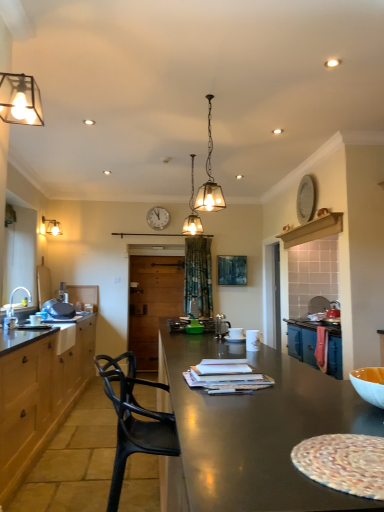
Question: Is satin silver coffee pot at center shorter than white wooden clock at upper center?

Choices:
 (A) yes
 (B) no

Answer: (A)

Question: Does satin silver coffee pot at center have a greater height compared to white wooden clock at upper center?

Choices:
 (A) no
 (B) yes

Answer: (A)

Question: Does satin silver coffee pot at center appear on the left side of white wooden clock at upper center?

Choices:
 (A) no
 (B) yes

Answer: (A)

Question: From a real-world perspective, does satin silver coffee pot at center sit lower than white wooden clock at upper center?

Choices:
 (A) no
 (B) yes

Answer: (B)

Question: Is the surface of satin silver coffee pot at center in direct contact with white wooden clock at upper center?

Choices:
 (A) yes
 (B) no

Answer: (B)

Question: Would you say translucent glass pendant light at center, which ranks as the 2th lamp in right-to-left order, is inside or outside wooden cabinets at left?

Choices:
 (A) inside
 (B) outside

Answer: (B)

Question: From the image's perspective, is translucent glass pendant light at center, positioned as the 3th lamp in left-to-right order, located above or below wooden cabinets at left?

Choices:
 (A) below
 (B) above

Answer: (B)

Question: Is translucent glass pendant light at center, positioned as the 3th lamp in left-to-right order, bigger or smaller than wooden cabinets at left?

Choices:
 (A) small
 (B) big

Answer: (A)

Question: From a real-world perspective, relative to wooden cabinets at left, is translucent glass pendant light at center, positioned as the 3th lamp in left-to-right order, vertically above or below?

Choices:
 (A) below
 (B) above

Answer: (B)

Question: From their relative heights in the image, would you say wooden cabinets at left is taller or shorter than matte brown countertop at left?

Choices:
 (A) tall
 (B) short

Answer: (A)

Question: From a real-world perspective, is wooden cabinets at left positioned above or below matte brown countertop at left?

Choices:
 (A) below
 (B) above

Answer: (A)

Question: In the image, is wooden cabinets at left positioned in front of or behind matte brown countertop at left?

Choices:
 (A) front
 (B) behind

Answer: (A)

Question: Is wooden cabinets at left bigger or smaller than matte brown countertop at left?

Choices:
 (A) small
 (B) big

Answer: (B)

Question: Is black plastic chair at center wider or thinner than matte glass lampshade at upper left, acting as the fourth lamp starting from the right?

Choices:
 (A) thin
 (B) wide

Answer: (B)

Question: Considering the relative positions of black plastic chair at center and matte glass lampshade at upper left, which is the 1th lamp in left-to-right order, in the image provided, is black plastic chair at center to the left or to the right of matte glass lampshade at upper left, which is the 1th lamp in left-to-right order,?

Choices:
 (A) right
 (B) left

Answer: (A)